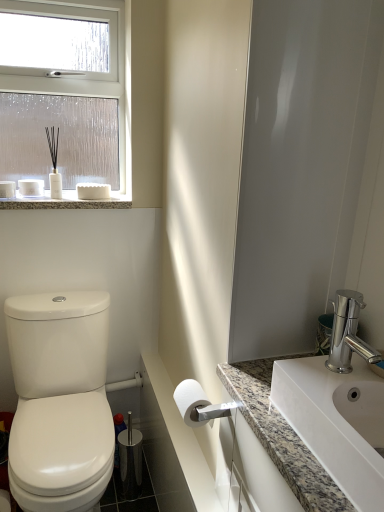
Question: Is white plastic towel bar at lower center at the left side of granite countertop at upper left?

Choices:
 (A) yes
 (B) no

Answer: (B)

Question: Is white plastic towel bar at lower center not inside granite countertop at upper left?

Choices:
 (A) no
 (B) yes

Answer: (B)

Question: Does white plastic towel bar at lower center have a larger size compared to granite countertop at upper left?

Choices:
 (A) yes
 (B) no

Answer: (B)

Question: From the image's perspective, is white plastic towel bar at lower center located above granite countertop at upper left?

Choices:
 (A) yes
 (B) no

Answer: (B)

Question: Is granite countertop at upper left located within white plastic towel bar at lower center?

Choices:
 (A) yes
 (B) no

Answer: (B)

Question: Does white plastic towel bar at lower center have a lesser width compared to granite countertop at upper left?

Choices:
 (A) no
 (B) yes

Answer: (B)

Question: Is granite countertop at lower right, the 1th counter top from the right, not within white matte toilet paper at center?

Choices:
 (A) no
 (B) yes

Answer: (B)

Question: Can you confirm if granite countertop at lower right, the 1th counter top from the right, is thinner than white matte toilet paper at center?

Choices:
 (A) yes
 (B) no

Answer: (B)

Question: From a real-world perspective, is granite countertop at lower right, the 1th counter top from the right, physically above white matte toilet paper at center?

Choices:
 (A) yes
 (B) no

Answer: (B)

Question: Is granite countertop at lower right, the 1th counter top from the right, not close to white matte toilet paper at center?

Choices:
 (A) no
 (B) yes

Answer: (A)

Question: From the image's perspective, is granite countertop at lower right, the 1th counter top from the right, above white matte toilet paper at center?

Choices:
 (A) yes
 (B) no

Answer: (B)

Question: Does granite countertop at lower right, the second counter top positioned from the left, have a larger size compared to white matte toilet paper at center?

Choices:
 (A) no
 (B) yes

Answer: (B)

Question: From a real-world perspective, is granite countertop at lower right, the 1th counter top from the right, positioned over white plastic towel bar at lower center based on gravity?

Choices:
 (A) no
 (B) yes

Answer: (B)